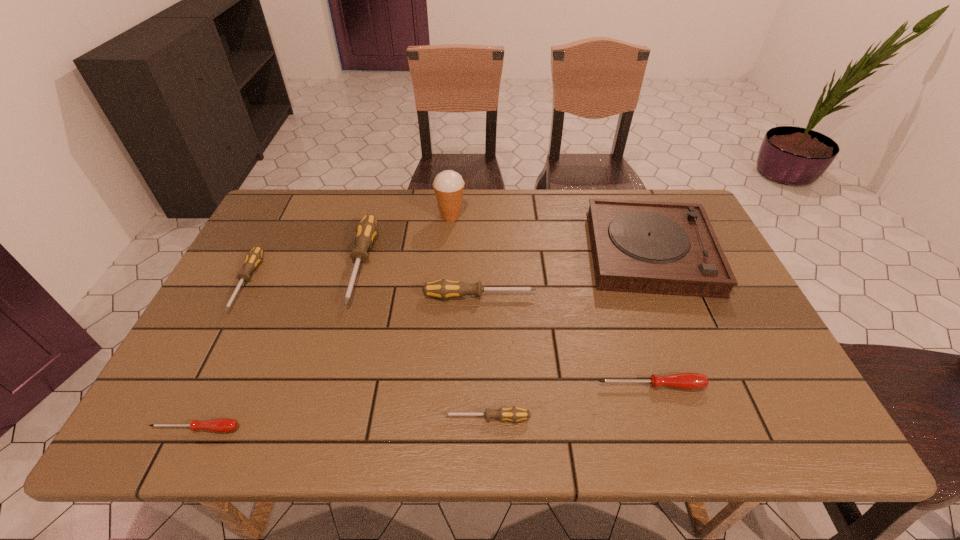
This screenshot has height=540, width=960. I want to click on vacant space positioned 0.200m at the tip of the smallest gray screwdriver, so click(x=348, y=418).

Image resolution: width=960 pixels, height=540 pixels. What are the coordinates of `vacant region located on the right of the shortest screwdriver` in the screenshot? It's located at (264, 429).

The image size is (960, 540). I want to click on icecream at the far edge, so click(x=448, y=185).

Identify the location of phonograph record positioned at the far edge. (667, 248).

Locate an element on the screen. This screenshot has width=960, height=540. screwdriver that is at the far edge is located at coordinates (366, 230).

Where is `object that is at the right edge`? object that is at the right edge is located at coordinates (667, 248).

Where is `object that is at the near left corner`? object that is at the near left corner is located at coordinates (222, 425).

This screenshot has width=960, height=540. In order to click on object that is at the far right corner in this screenshot , I will do `click(667, 248)`.

The width and height of the screenshot is (960, 540). What are the coordinates of `free space at the far edge` in the screenshot? It's located at (345, 209).

In the image, there is a desktop. At what (x,y) coordinates should I click in order to perform the action: click on free space at the near edge. Please return your answer as a coordinate pair (x, y). Looking at the image, I should click on (276, 409).